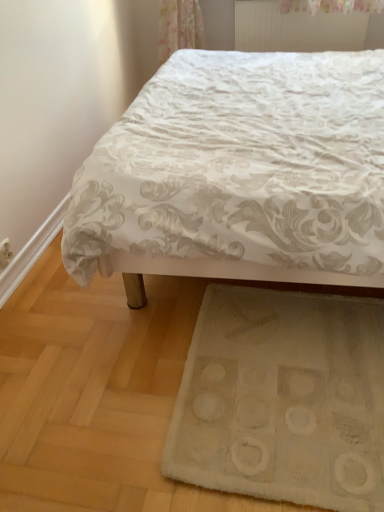
Question: Is white soft rug at lower center located outside white textured bed at center?

Choices:
 (A) no
 (B) yes

Answer: (A)

Question: Is white textured bed at center a part of white soft rug at lower center?

Choices:
 (A) no
 (B) yes

Answer: (A)

Question: Is white soft rug at lower center at the left side of white textured bed at center?

Choices:
 (A) no
 (B) yes

Answer: (B)

Question: From a real-world perspective, is white soft rug at lower center on top of white textured bed at center?

Choices:
 (A) yes
 (B) no

Answer: (B)

Question: From a real-world perspective, is white soft rug at lower center positioned under white textured bed at center based on gravity?

Choices:
 (A) yes
 (B) no

Answer: (A)

Question: In terms of size, does white soft rug at lower center appear bigger or smaller than white textured bed at center?

Choices:
 (A) big
 (B) small

Answer: (B)

Question: Does point (299, 332) appear closer or farther from the camera than point (210, 76)?

Choices:
 (A) farther
 (B) closer

Answer: (B)

Question: Is white soft rug at lower center spatially inside white textured bed at center, or outside of it?

Choices:
 (A) outside
 (B) inside

Answer: (B)

Question: In the image, is white soft rug at lower center on the left side or the right side of white textured bed at center?

Choices:
 (A) left
 (B) right

Answer: (A)

Question: Is white soft rug at lower center in front of or behind white textured radiator at upper center in the image?

Choices:
 (A) front
 (B) behind

Answer: (A)

Question: Is white soft rug at lower center spatially inside white textured radiator at upper center, or outside of it?

Choices:
 (A) outside
 (B) inside

Answer: (A)

Question: Looking at their shapes, would you say white soft rug at lower center is wider or thinner than white textured radiator at upper center?

Choices:
 (A) wide
 (B) thin

Answer: (A)

Question: From a real-world perspective, relative to white textured radiator at upper center, is white soft rug at lower center vertically above or below?

Choices:
 (A) above
 (B) below

Answer: (B)

Question: Looking at their shapes, would you say white textured bed at center is wider or thinner than white soft rug at lower center?

Choices:
 (A) thin
 (B) wide

Answer: (B)

Question: From the image's perspective, is white textured bed at center positioned above or below white soft rug at lower center?

Choices:
 (A) below
 (B) above

Answer: (B)